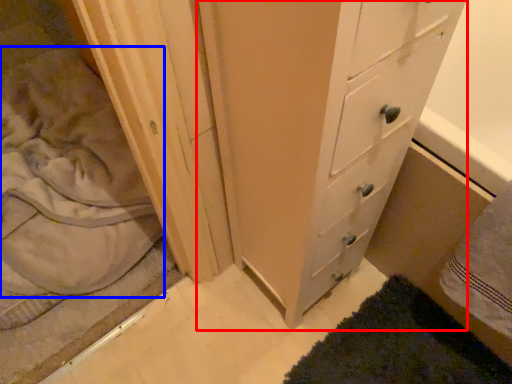
Question: Which object appears farthest to the camera in this image, chest of drawers (highlighted by a red box) or sheet (highlighted by a blue box)?

Choices:
 (A) chest of drawers
 (B) sheet

Answer: (B)